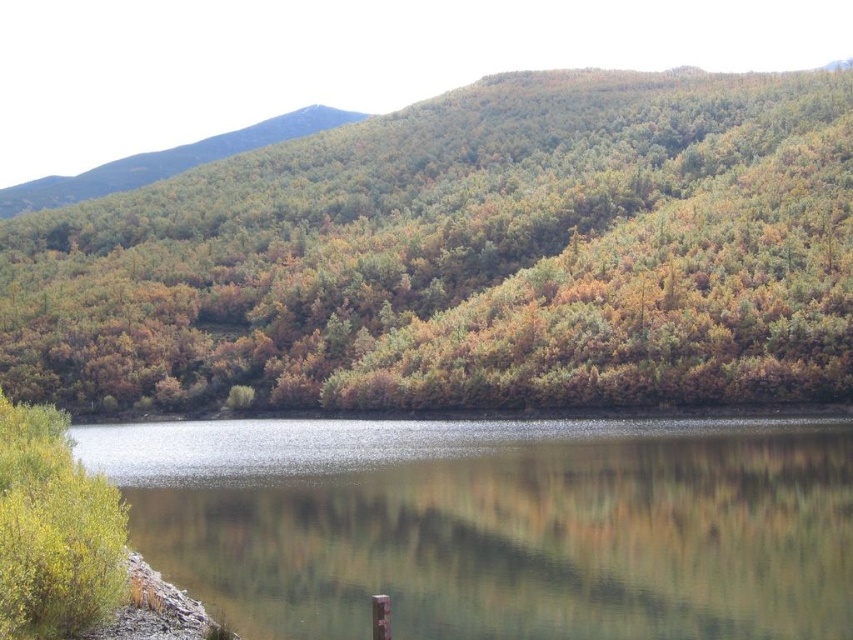
Question: Which of the following is the closest to the observer?

Choices:
 (A) green matte bush at lower left
 (B) clear water at center

Answer: (A)

Question: Is the position of green matte forest at upper center less distant than that of green matte bush at lower left?

Choices:
 (A) yes
 (B) no

Answer: (B)

Question: Which point appears farthest from the camera in this image?

Choices:
 (A) (525, 211)
 (B) (93, 518)

Answer: (A)

Question: Is clear water at center wider than green matte bush at lower left?

Choices:
 (A) no
 (B) yes

Answer: (B)

Question: In this image, where is clear water at center located relative to green matte bush at lower left?

Choices:
 (A) above
 (B) below

Answer: (B)

Question: Which object appears farthest from the camera in this image?

Choices:
 (A) clear water at center
 (B) green leafy hillside at upper left

Answer: (B)